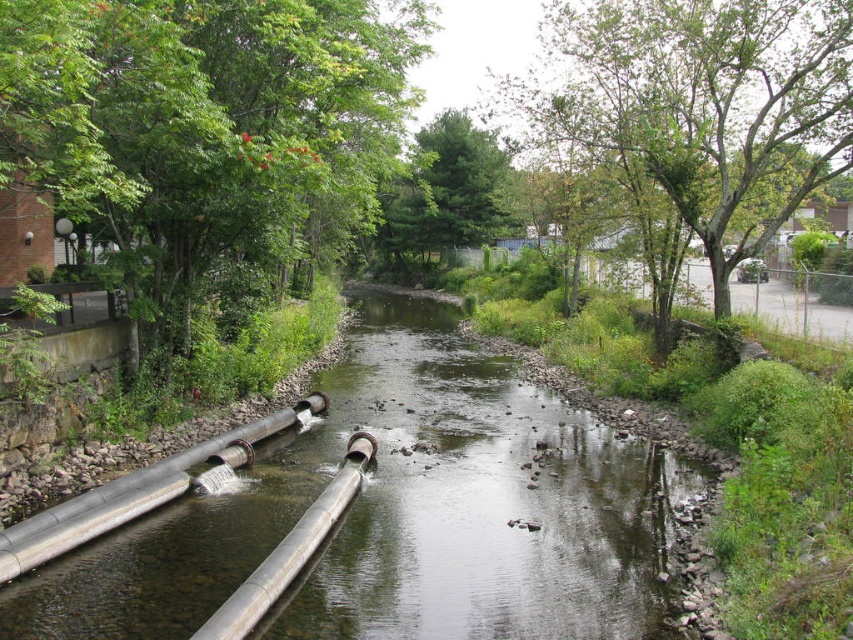
You are planning to plant a new tree that requires a minimum of 30 feet of space between it and the nearest existing tree. Based on the scene, can you plant the new tree between the green leafy tree at upper right and the green matte tree at center?

The distance between the green leafy tree at upper right and the green matte tree at center is 33.02 feet, which exceeds the required 30 feet minimum. Therefore, planting the new tree between them would be acceptable as it meets the spacing requirement.

You are planning to plant a new tree in this area. The green leafy tree at upper right and the green matte tree at center are already present. Which existing tree should you consider for shade if you want a larger canopy?

The green leafy tree at upper right should be considered for shade because it is bigger than the green matte tree at center, indicating a larger canopy.